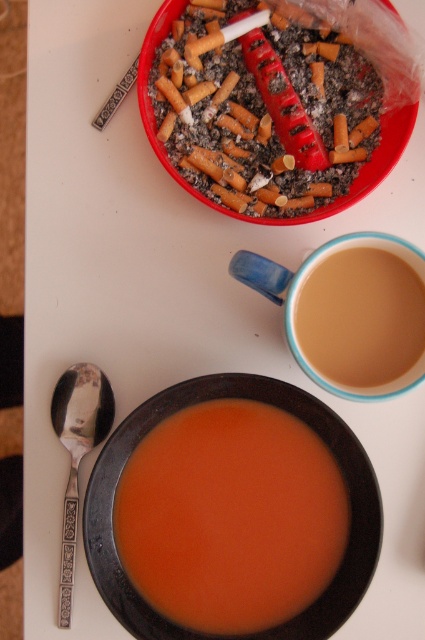
You are a guest at a dinner party and need to place your napkin. You see the red plastic ashtray at upper center and the brown matte cup at center. Which object is located higher on the table?

The red plastic ashtray at upper center is located higher on the table than the brown matte cup at center.

You are looking at the tabletop scene. There are two points marked on the table surface. The first point is at coordinates point (x=308, y=596) and the second point is at point (x=241, y=100). Which of these two points is closer to you?

Point (x=308, y=596) is closer to the viewer than point (x=241, y=100).